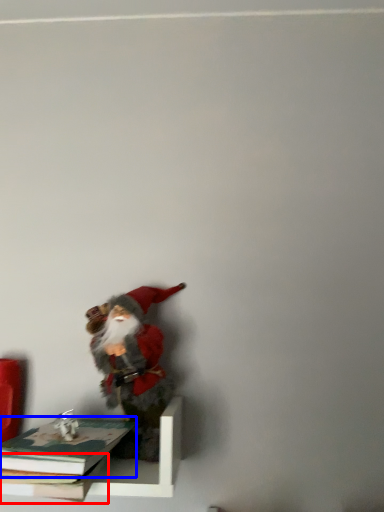
Question: Which of the following is the farthest to the observer, book (highlighted by a red box) or book (highlighted by a blue box)?

Choices:
 (A) book
 (B) book

Answer: (A)